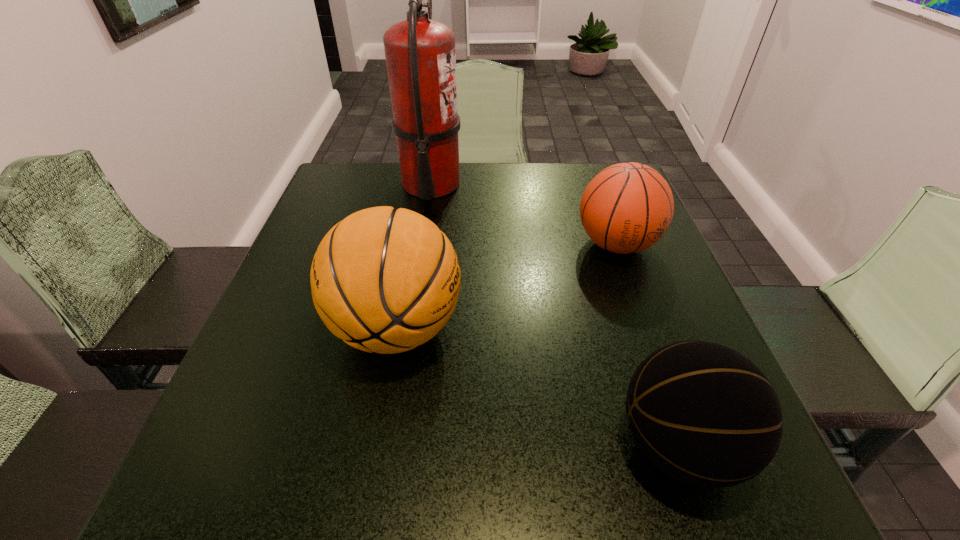
Identify the location of vacant space at the near right corner of the desktop. The height and width of the screenshot is (540, 960). (659, 469).

Locate an element on the screen. vacant area between the second farthest object and the fire extinguisher is located at coordinates (524, 214).

Where is `free space between the fire extinguisher and the nearest object`? free space between the fire extinguisher and the nearest object is located at coordinates (555, 314).

The height and width of the screenshot is (540, 960). Find the location of `empty space that is in between the nearest basketball and the tallest object`. empty space that is in between the nearest basketball and the tallest object is located at coordinates (555, 314).

Identify the location of vacant space that's between the farthest basketball and the nearest basketball. (647, 345).

Image resolution: width=960 pixels, height=540 pixels. I want to click on free spot between the nearest basketball and the third shortest object, so click(x=538, y=386).

Where is `vacant space that is in between the second nearest basketball and the nearest object`? vacant space that is in between the second nearest basketball and the nearest object is located at coordinates (538, 386).

The image size is (960, 540). In order to click on vacant area that lies between the nearest basketball and the farthest basketball in this screenshot , I will do `click(647, 345)`.

Find the location of a particular element. The height and width of the screenshot is (540, 960). vacant space that is in between the nearest basketball and the second farthest basketball is located at coordinates (x=538, y=386).

Where is `vacant area between the leftmost basketball and the nearest basketball`? This screenshot has height=540, width=960. vacant area between the leftmost basketball and the nearest basketball is located at coordinates [x=538, y=386].